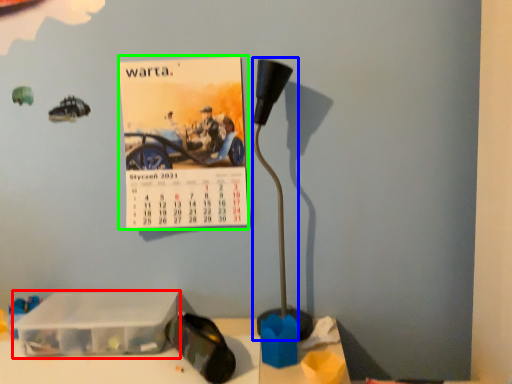
Question: Which is farther away from box (highlighted by a red box)? lamp (highlighted by a blue box) or postcard (highlighted by a green box)?

Choices:
 (A) lamp
 (B) postcard

Answer: (A)